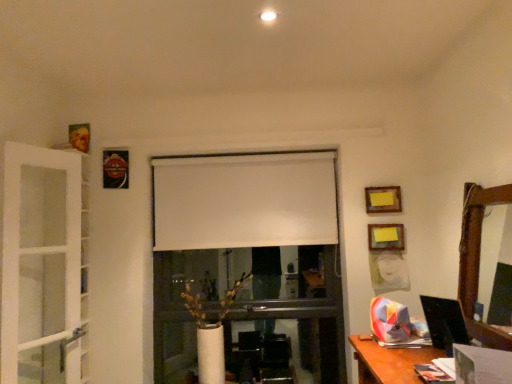
Question: Is point tap(389, 281) positioned closer to the camera than point tap(202, 221)?

Choices:
 (A) closer
 (B) farther

Answer: (A)

Question: Looking at their shapes, would you say matte white picture frame at right, which is the first picture frame in bottom-to-top order, is wider or thinner than white matte curtain at center?

Choices:
 (A) wide
 (B) thin

Answer: (B)

Question: Which object is positioned closest to the matte white picture frame at right, the 4th picture frame in the left-to-right sequence?

Choices:
 (A) white matte curtain at center
 (B) yellow paper at upper center, the 3th picture frame when ordered from right to left
 (C) wooden picture frame at upper right, which is counted as the 3th picture frame, starting from the top
 (D) white glass screen door at left
 (E) metallic reflective picture frame at upper left, the fourth picture frame in the bottom-to-top sequence

Answer: (C)

Question: Based on their relative distances, which object is farther from the yellow paper at upper center, the 2th picture frame when ordered from top to bottom?

Choices:
 (A) white matte curtain at center
 (B) matte white picture frame at right, the 4th picture frame in the left-to-right sequence
 (C) white glass screen door at left
 (D) wooden frame mirror at right
 (E) metallic reflective picture frame at upper left, which appears as the 4th picture frame when viewed from the right

Answer: (C)